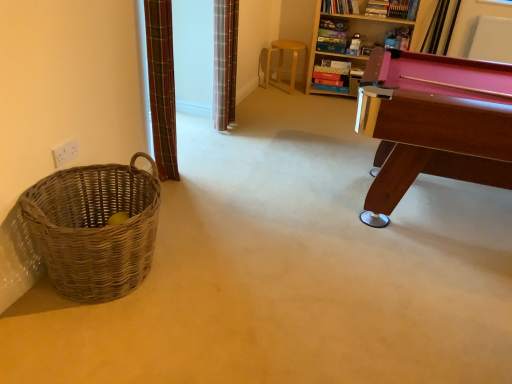
Question: Can you confirm if light brown wooden stool at center is bigger than wooden bookcase at upper right?

Choices:
 (A) yes
 (B) no

Answer: (B)

Question: Does light brown wooden stool at center turn towards wooden bookcase at upper right?

Choices:
 (A) yes
 (B) no

Answer: (B)

Question: Can wooden bookcase at upper right be found inside light brown wooden stool at center?

Choices:
 (A) yes
 (B) no

Answer: (B)

Question: Can you confirm if light brown wooden stool at center is shorter than wooden bookcase at upper right?

Choices:
 (A) yes
 (B) no

Answer: (A)

Question: From the image's perspective, does light brown wooden stool at center appear higher than wooden bookcase at upper right?

Choices:
 (A) no
 (B) yes

Answer: (A)

Question: From a real-world perspective, is woven brown basket at left above or below plaid fabric curtain at upper center, arranged as the second curtain when viewed from the left?

Choices:
 (A) above
 (B) below

Answer: (B)

Question: Is point (142, 243) closer or farther from the camera than point (215, 18)?

Choices:
 (A) farther
 (B) closer

Answer: (B)

Question: Considering the positions of woven brown basket at left and plaid fabric curtain at upper center, which ranks as the first curtain in right-to-left order, in the image, is woven brown basket at left wider or thinner than plaid fabric curtain at upper center, which ranks as the first curtain in right-to-left order,?

Choices:
 (A) wide
 (B) thin

Answer: (A)

Question: In the image, is woven brown basket at left positioned in front of or behind plaid fabric curtain at upper center, which ranks as the 2th curtain in front-to-back order?

Choices:
 (A) front
 (B) behind

Answer: (A)

Question: From their relative heights in the image, would you say wooden bookcase at upper right is taller or shorter than plaid fabric curtain at upper center, the first curtain positioned from the back?

Choices:
 (A) tall
 (B) short

Answer: (A)

Question: Is point (431, 6) closer or farther from the camera than point (223, 92)?

Choices:
 (A) closer
 (B) farther

Answer: (B)

Question: Based on their sizes in the image, would you say wooden bookcase at upper right is bigger or smaller than plaid fabric curtain at upper center, the first curtain positioned from the back?

Choices:
 (A) big
 (B) small

Answer: (A)

Question: Based on their positions, is wooden bookcase at upper right located to the left or right of plaid fabric curtain at upper center, the first curtain positioned from the back?

Choices:
 (A) right
 (B) left

Answer: (A)

Question: Relative to wooden bookcase at upper right, is plaid fabric curtain at left, acting as the second curtain starting from the right, in front or behind?

Choices:
 (A) behind
 (B) front

Answer: (B)

Question: From a real-world perspective, is plaid fabric curtain at left, the first curtain positioned from the left, above or below wooden bookcase at upper right?

Choices:
 (A) above
 (B) below

Answer: (A)